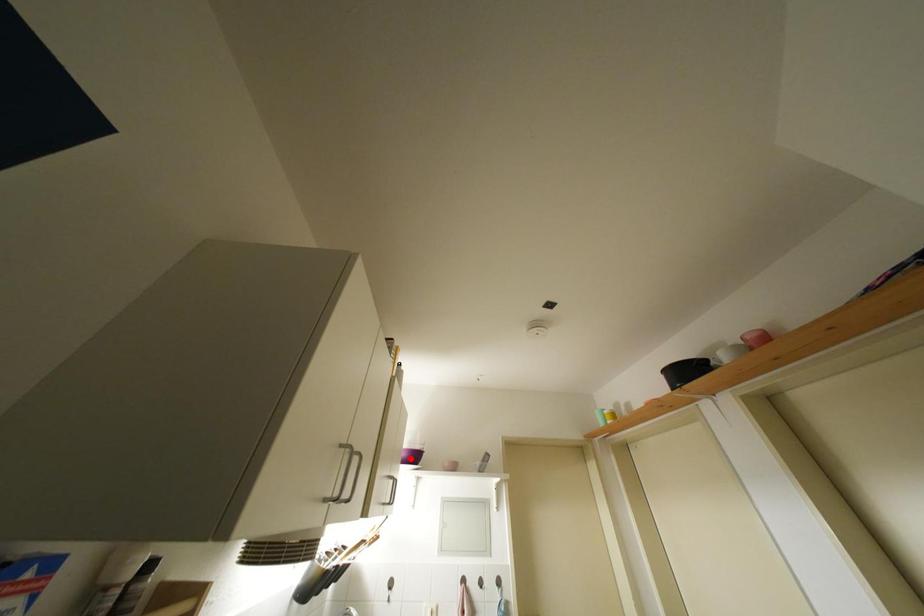
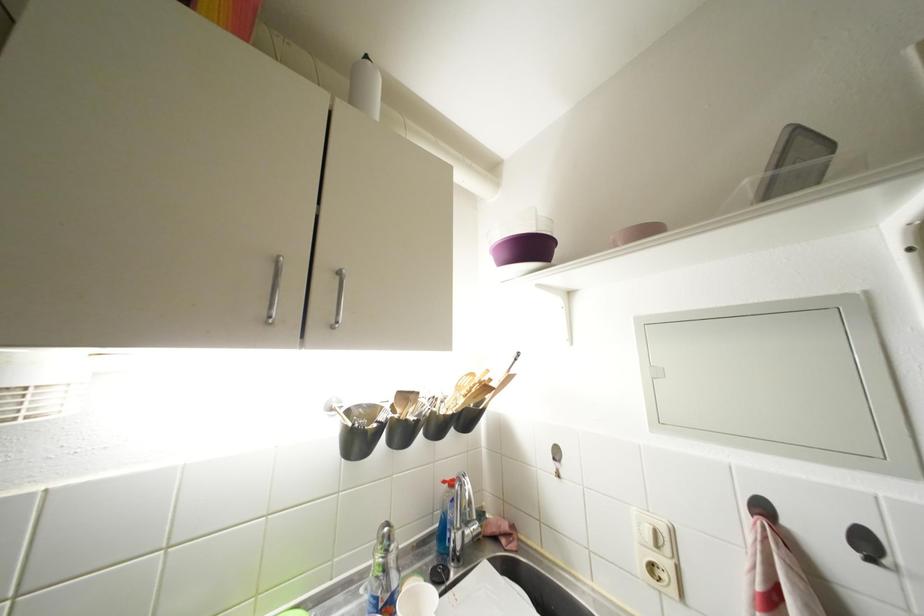
Where in the second image is the point corresponding to the highlighted location from the first image?

(512, 259)